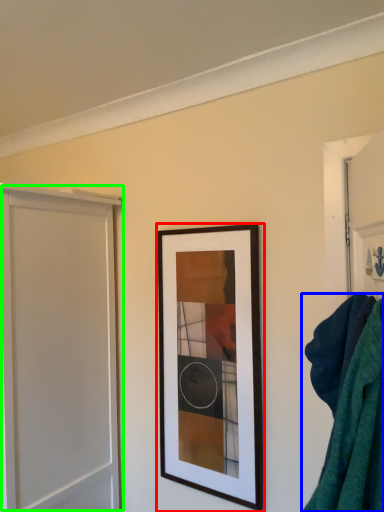
Question: Considering the real-world distances, which object is closest to picture frame (highlighted by a red box)? bath towel (highlighted by a blue box) or screen door (highlighted by a green box).

Choices:
 (A) bath towel
 (B) screen door

Answer: (B)